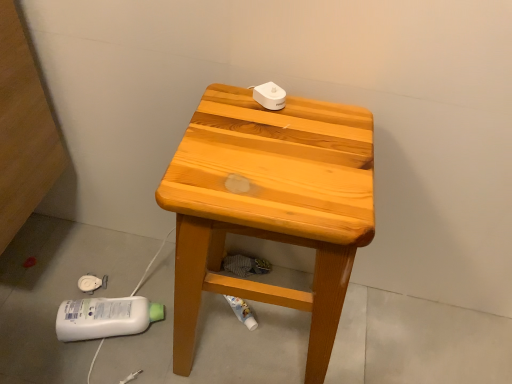
You are a GUI agent. You are given a task and a screenshot of the screen. Output one action in this format:
    pyautogui.click(x=<x>, y=<y>)
    Task: Click on the wooden stool at center
    This screenshot has height=384, width=512.
    Given the screenshot: What is the action you would take?
    pyautogui.click(x=58, y=293)

Describe the element at coordinates (58, 293) in the screenshot. This screenshot has width=512, height=384. I see `wooden stool at center` at that location.

At what (x,y) coordinates should I click in order to perform the action: click on light brown wooden stool at center. Please return your answer as a coordinate pair (x, y). Image resolution: width=512 pixels, height=384 pixels. Looking at the image, I should click on (269, 205).

This screenshot has width=512, height=384. Describe the element at coordinates (269, 205) in the screenshot. I see `light brown wooden stool at center` at that location.

I want to click on wooden stool at center, so click(x=58, y=293).

Which is more to the right, light brown wooden stool at center or wooden stool at center?

From the viewer's perspective, light brown wooden stool at center appears more on the right side.

Is the depth of light brown wooden stool at center greater than that of wooden stool at center?

That is False.

Is point (215, 105) closer or farther from the camera than point (151, 252)?

Point (215, 105) is closer to the camera than point (151, 252).

From the image's perspective, is light brown wooden stool at center located above or below wooden stool at center?

From the image's perspective, light brown wooden stool at center appears above wooden stool at center.

From a real-world perspective, is light brown wooden stool at center physically located above or below wooden stool at center?

In terms of real-world spatial position, light brown wooden stool at center is above wooden stool at center.

Considering the sizes of objects light brown wooden stool at center and wooden stool at center in the image provided, who is wider, light brown wooden stool at center or wooden stool at center?

With larger width is wooden stool at center.

Is light brown wooden stool at center taller than wooden stool at center?

Correct, light brown wooden stool at center is much taller as wooden stool at center.

Can you confirm if light brown wooden stool at center is bigger than wooden stool at center?

Indeed, light brown wooden stool at center has a larger size compared to wooden stool at center.

Is light brown wooden stool at center spatially inside wooden stool at center, or outside of it?

light brown wooden stool at center lies outside wooden stool at center.

Is light brown wooden stool at center placed right next to wooden stool at center?

light brown wooden stool at center and wooden stool at center are not in contact.

Is light brown wooden stool at center oriented away from wooden stool at center?

No.

Can you tell me how much light brown wooden stool at center and wooden stool at center differ in facing direction?

The angular difference between light brown wooden stool at center and wooden stool at center is 89.1 degrees.

How distant is light brown wooden stool at center from wooden stool at center?

They are 38.98 centimeters apart.

Where is `stool that is on the right side of wooden stool at center`? stool that is on the right side of wooden stool at center is located at coordinates (269, 205).

Can you confirm if wooden stool at center is positioned to the left of light brown wooden stool at center?

Yes.

Considering the positions of objects wooden stool at center and light brown wooden stool at center in the image provided, who is in front, wooden stool at center or light brown wooden stool at center?

light brown wooden stool at center is closer to the camera.

Is point (422, 345) closer or farther from the camera than point (276, 228)?

Point (422, 345) is positioned farther from the camera compared to point (276, 228).

From the image's perspective, is wooden stool at center above or below light brown wooden stool at center?

wooden stool at center is below light brown wooden stool at center.

From a real-world perspective, which object rests below the other?

From a 3D spatial view, wooden stool at center is below.

Is wooden stool at center wider or thinner than light brown wooden stool at center?

wooden stool at center is wider than light brown wooden stool at center.

Is wooden stool at center taller or shorter than light brown wooden stool at center?

In the image, wooden stool at center appears to be shorter than light brown wooden stool at center.

Does wooden stool at center have a larger size compared to light brown wooden stool at center?

Incorrect, wooden stool at center is not larger than light brown wooden stool at center.

Is wooden stool at center inside or outside of light brown wooden stool at center?

wooden stool at center is located beyond the bounds of light brown wooden stool at center.

Would you say wooden stool at center is a long distance from light brown wooden stool at center?

No, wooden stool at center is in close proximity to light brown wooden stool at center.

Could you tell me if wooden stool at center is turned towards light brown wooden stool at center?

Yes, wooden stool at center is facing light brown wooden stool at center.

How different are the orientations of wooden stool at center and light brown wooden stool at center in degrees?

There is a 89.1-degree angle between the facing directions of wooden stool at center and light brown wooden stool at center.

Locate an element on the screen. The width and height of the screenshot is (512, 384). stool lying in front of the wooden stool at center is located at coordinates (269, 205).

Where is `stool in front of the wooden stool at center`? The image size is (512, 384). stool in front of the wooden stool at center is located at coordinates (269, 205).

Locate an element on the screen. concrete located below the light brown wooden stool at center (from the image's perspective) is located at coordinates (58, 293).